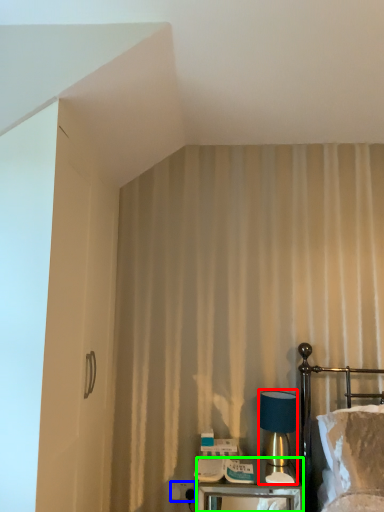
Question: Which object is the farthest from table lamp (highlighted by a red box)? Choose among these: electric outlet (highlighted by a blue box) or nightstand (highlighted by a green box).

Choices:
 (A) electric outlet
 (B) nightstand

Answer: (A)